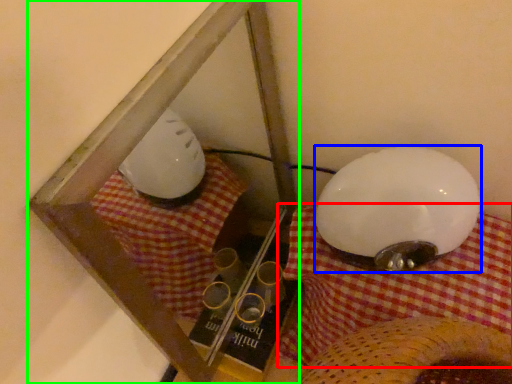
Question: Which object is the farthest from blanket (highlighted by a red box)? Choose among these: lamp (highlighted by a blue box) or glass box (highlighted by a green box).

Choices:
 (A) lamp
 (B) glass box

Answer: (B)